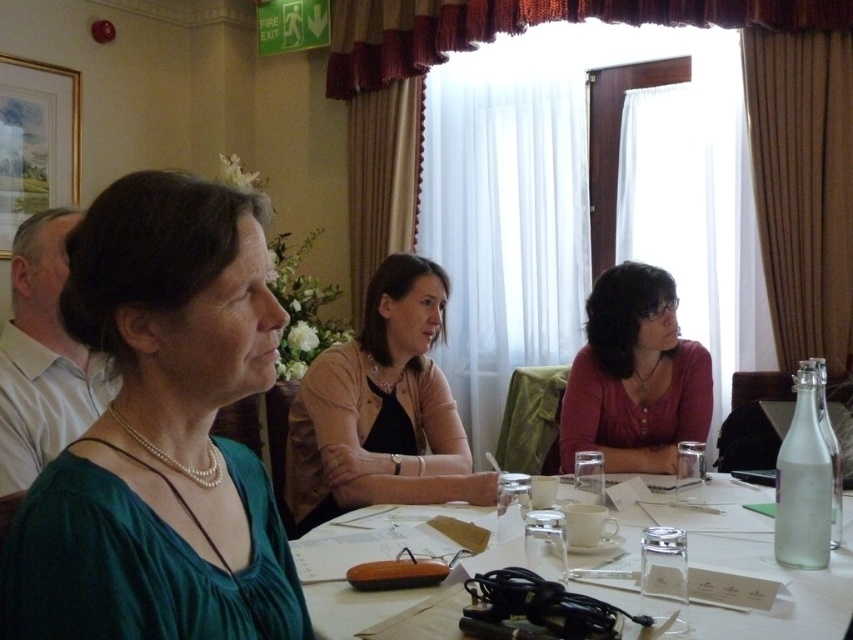
Who is higher up, green silk blouse at center or pink fabric shirt at center?

Positioned higher is green silk blouse at center.

Which is in front, point (199, 372) or point (461, 445)?

Positioned in front is point (199, 372).

The image size is (853, 640). What are the coordinates of `green silk blouse at center` in the screenshot? It's located at (160, 433).

Does white shirt at left have a smaller size compared to clear glass bottle at right?

Actually, white shirt at left might be larger than clear glass bottle at right.

Does point (30, 348) come behind point (816, 481)?

That is True.

Is point (21, 490) farther from camera compared to point (814, 448)?

No, (21, 490) is in front of (814, 448).

This screenshot has width=853, height=640. Find the location of `white shirt at left`. white shirt at left is located at coordinates (x=44, y=356).

Between point (407, 285) and point (807, 512), which one is positioned behind?

The point (407, 285) is more distant.

Image resolution: width=853 pixels, height=640 pixels. Describe the element at coordinates (380, 410) in the screenshot. I see `pink fabric shirt at center` at that location.

Where is `pink fabric shirt at center`? The height and width of the screenshot is (640, 853). pink fabric shirt at center is located at coordinates (380, 410).